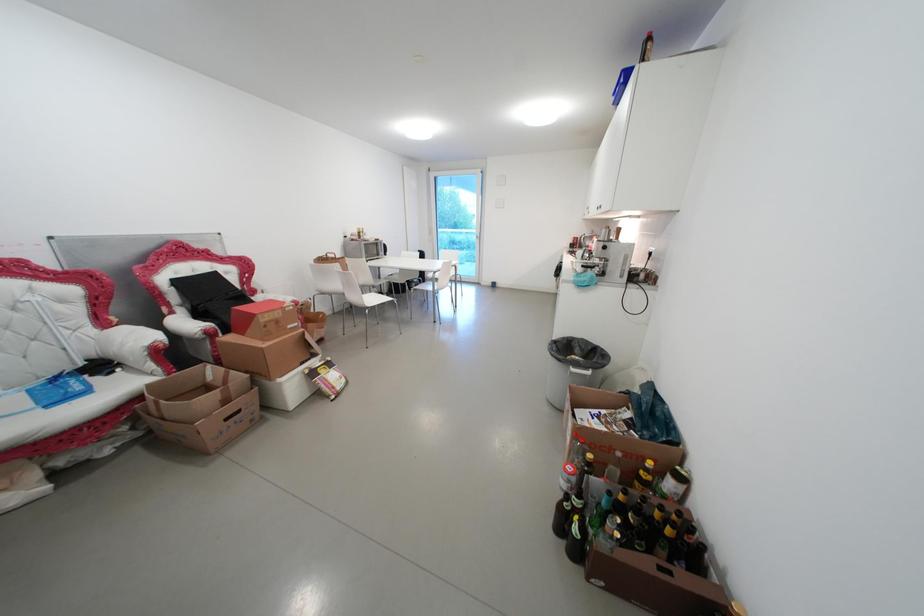
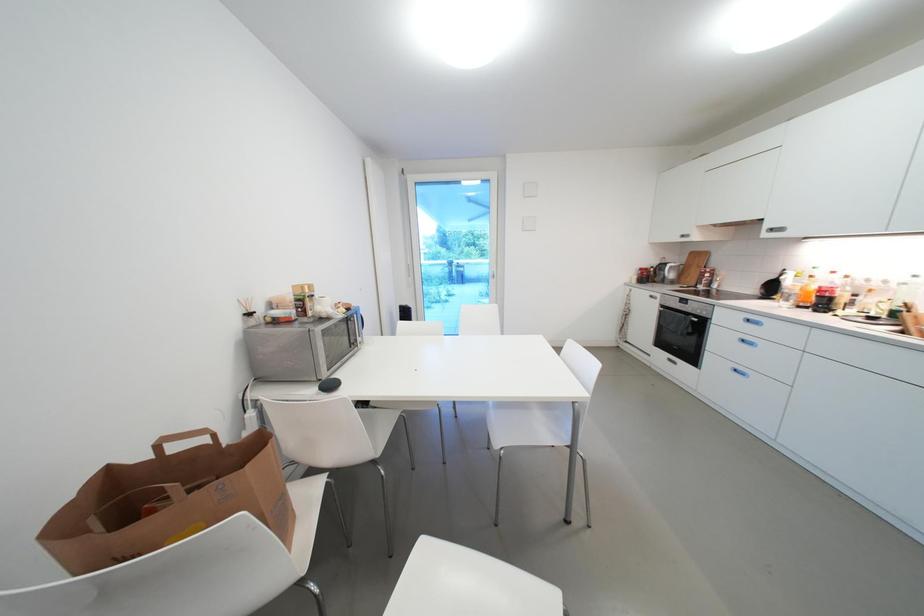
Which direction would the cameraman need to move to produce the second image?

The cameraman moved toward left, forward.